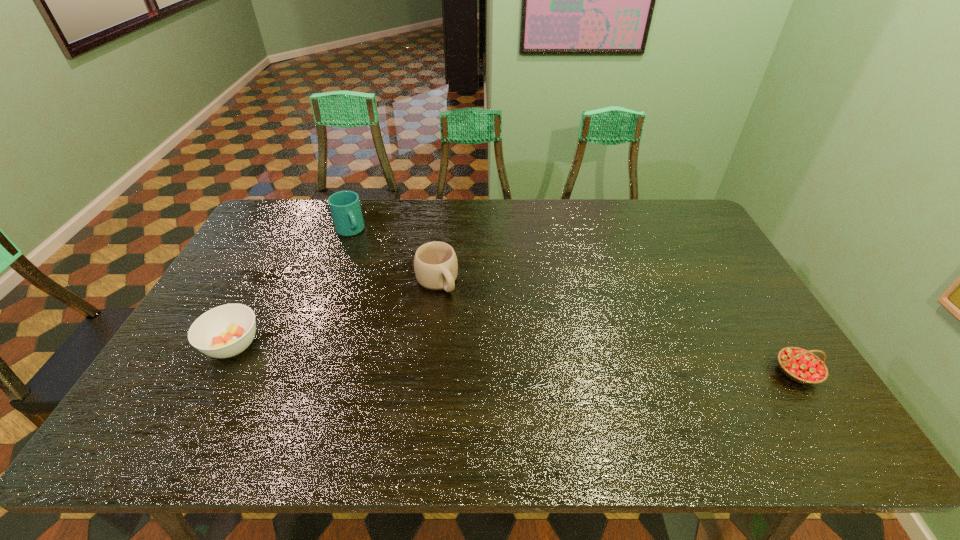
Where is `vacant space located 0.330m on the handle side of the farthest object`? This screenshot has width=960, height=540. vacant space located 0.330m on the handle side of the farthest object is located at coordinates (394, 297).

Where is `vacant space located 0.370m on the side of the third object from left to right with the handle`? vacant space located 0.370m on the side of the third object from left to right with the handle is located at coordinates (517, 388).

Find the location of a particular element. The height and width of the screenshot is (540, 960). free space located 0.320m on the side of the third object from left to right with the handle is located at coordinates (507, 374).

Locate an element on the screen. The image size is (960, 540). vacant space located 0.080m on the side of the third object from left to right with the handle is located at coordinates (460, 314).

The width and height of the screenshot is (960, 540). In order to click on object that is positioned at the far edge in this screenshot , I will do `click(345, 208)`.

Identify the location of object that is positioned at the near edge. This screenshot has height=540, width=960. (802, 366).

What are the coordinates of `object positioned at the left edge` in the screenshot? It's located at (227, 330).

Image resolution: width=960 pixels, height=540 pixels. I want to click on object at the right edge, so click(802, 366).

The width and height of the screenshot is (960, 540). Find the location of `object that is at the near right corner`. object that is at the near right corner is located at coordinates (802, 366).

Where is `vacant area at the far edge`? The image size is (960, 540). vacant area at the far edge is located at coordinates (468, 233).